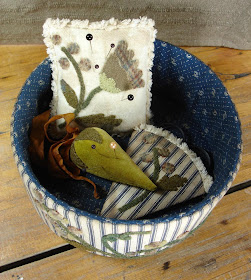
At what (x,y) coordinates should I click in order to perform the action: click on white square pillow. Please return your answer as a coordinate pair (x, y). The height and width of the screenshot is (280, 251). Looking at the image, I should click on (x=139, y=46).